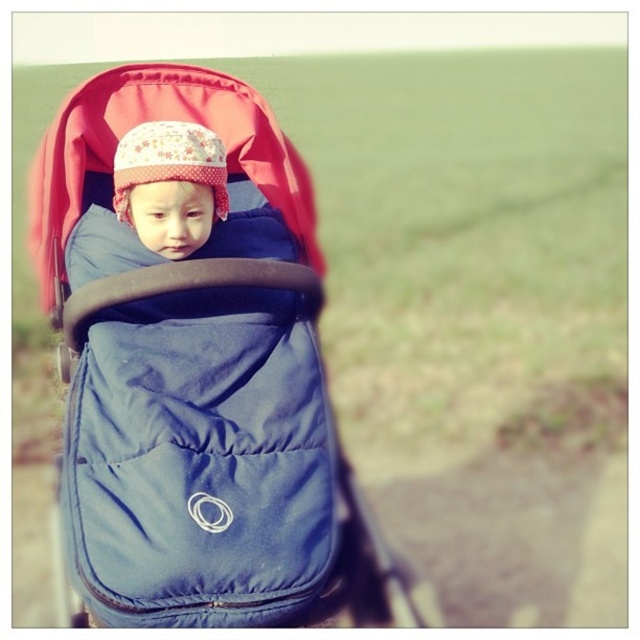
Question: Does blue fabric baby carriage at center appear under fluffy fabric hat at center?

Choices:
 (A) no
 (B) yes

Answer: (B)

Question: Among these points, which one is farthest from the camera?

Choices:
 (A) (262, 577)
 (B) (211, 209)

Answer: (B)

Question: Which object is farther from the camera taking this photo?

Choices:
 (A) fluffy fabric hat at center
 (B) blue fabric baby carriage at center

Answer: (A)

Question: Which point appears farthest from the camera in this image?

Choices:
 (A) (122, 212)
 (B) (99, 148)

Answer: (B)

Question: Is blue fabric baby carriage at center positioned in front of fluffy fabric hat at center?

Choices:
 (A) yes
 (B) no

Answer: (A)

Question: Can you confirm if blue fabric baby carriage at center is positioned to the right of fluffy fabric hat at center?

Choices:
 (A) yes
 (B) no

Answer: (A)